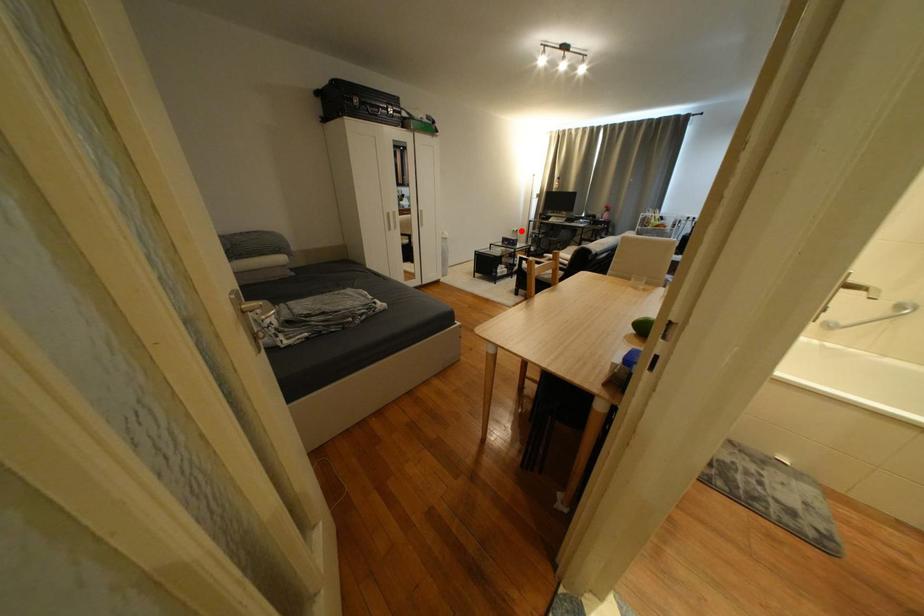
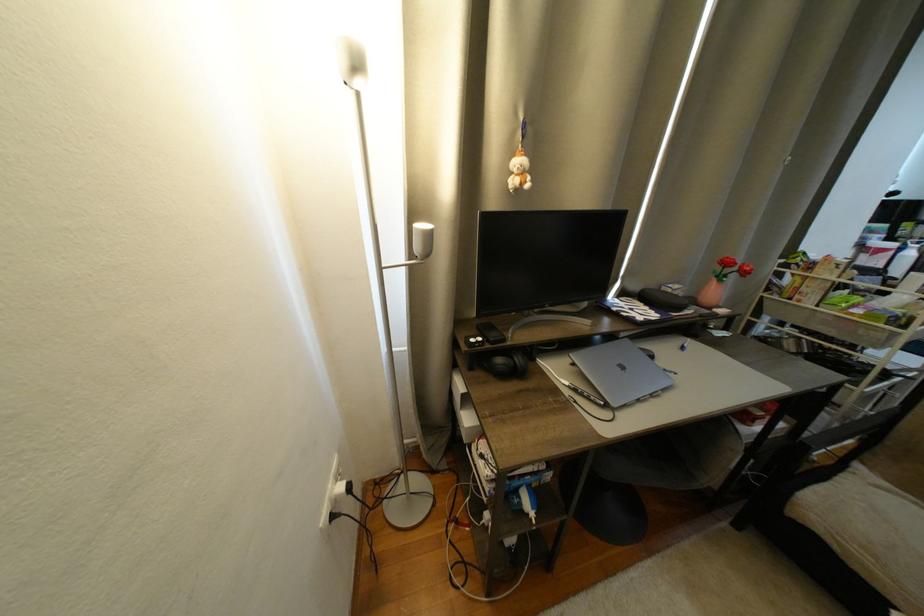
In the second image, find the point that corresponds to the highlighted location in the first image.

(333, 520)